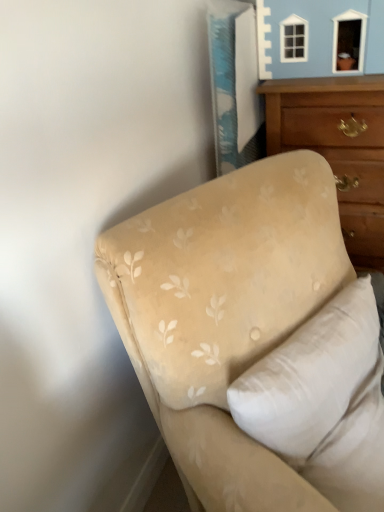
Question: Does wooden chest of drawers at upper right lie in front of beige fabric pillow at upper right?

Choices:
 (A) yes
 (B) no

Answer: (B)

Question: Considering the relative positions of wooden chest of drawers at upper right and beige fabric pillow at upper right in the image provided, is wooden chest of drawers at upper right to the right of beige fabric pillow at upper right from the viewer's perspective?

Choices:
 (A) yes
 (B) no

Answer: (A)

Question: Could beige fabric pillow at upper right be considered to be inside wooden chest of drawers at upper right?

Choices:
 (A) yes
 (B) no

Answer: (B)

Question: Does wooden chest of drawers at upper right have a smaller size compared to beige fabric pillow at upper right?

Choices:
 (A) no
 (B) yes

Answer: (A)

Question: Does wooden chest of drawers at upper right have a lesser width compared to beige fabric pillow at upper right?

Choices:
 (A) no
 (B) yes

Answer: (A)

Question: Looking at their shapes, would you say beige fabric couch at lower right is wider or thinner than wooden chest of drawers at upper right?

Choices:
 (A) wide
 (B) thin

Answer: (A)

Question: From a real-world perspective, is beige fabric couch at lower right physically located above or below wooden chest of drawers at upper right?

Choices:
 (A) below
 (B) above

Answer: (A)

Question: Is beige fabric couch at lower right bigger or smaller than wooden chest of drawers at upper right?

Choices:
 (A) small
 (B) big

Answer: (B)

Question: From the image's perspective, is beige fabric couch at lower right located above or below wooden chest of drawers at upper right?

Choices:
 (A) above
 (B) below

Answer: (B)

Question: From a real-world perspective, relative to beige fabric couch at lower right, is wooden chest of drawers at upper right vertically above or below?

Choices:
 (A) below
 (B) above

Answer: (B)

Question: Would you say wooden chest of drawers at upper right is inside or outside beige fabric couch at lower right?

Choices:
 (A) inside
 (B) outside

Answer: (B)

Question: In terms of height, does wooden chest of drawers at upper right look taller or shorter compared to beige fabric couch at lower right?

Choices:
 (A) short
 (B) tall

Answer: (B)

Question: Based on their positions, is wooden chest of drawers at upper right located to the left or right of beige fabric couch at lower right?

Choices:
 (A) left
 (B) right

Answer: (B)

Question: In terms of height, does beige fabric pillow at upper right look taller or shorter compared to wooden chest of drawers at upper right?

Choices:
 (A) short
 (B) tall

Answer: (A)

Question: In terms of size, does beige fabric pillow at upper right appear bigger or smaller than wooden chest of drawers at upper right?

Choices:
 (A) big
 (B) small

Answer: (B)